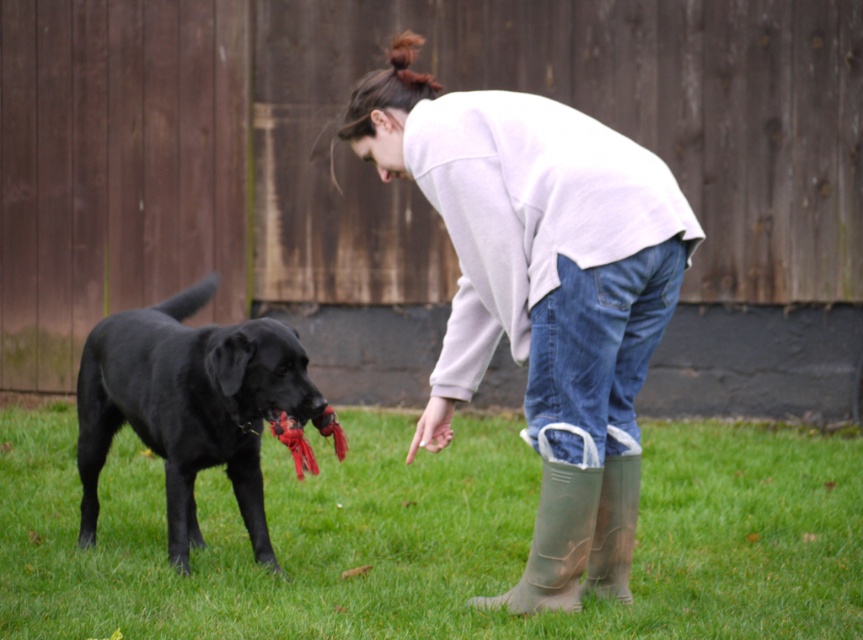
Describe the element at coordinates (189, 406) in the screenshot. The width and height of the screenshot is (863, 640). I see `shiny black dog at left` at that location.

Is shiny black dog at left smaller than rubber boots at lower right?

No, shiny black dog at left is not smaller than rubber boots at lower right.

Is point (82, 376) positioned behind point (600, 486)?

Yes, point (82, 376) is behind point (600, 486).

Locate an element on the screen. The height and width of the screenshot is (640, 863). shiny black dog at left is located at coordinates (189, 406).

Which is behind, point (426, 429) or point (253, 525)?

Positioned behind is point (253, 525).

Is white cotton sweatshirt at center to the left of shiny black dog at left from the viewer's perspective?

Incorrect, white cotton sweatshirt at center is not on the left side of shiny black dog at left.

Where is `white cotton sweatshirt at center`? white cotton sweatshirt at center is located at coordinates (536, 280).

At what (x,y) coordinates should I click in order to perform the action: click on white cotton sweatshirt at center. Please return your answer as a coordinate pair (x, y). Image resolution: width=863 pixels, height=640 pixels. Looking at the image, I should click on (536, 280).

Can you confirm if green rubber boot at lower center is shorter than rubber boots at lower right?

No.

Can you confirm if green rubber boot at lower center is thinner than rubber boots at lower right?

In fact, green rubber boot at lower center might be wider than rubber boots at lower right.

Locate an element on the screen. This screenshot has height=640, width=863. green rubber boot at lower center is located at coordinates (555, 541).